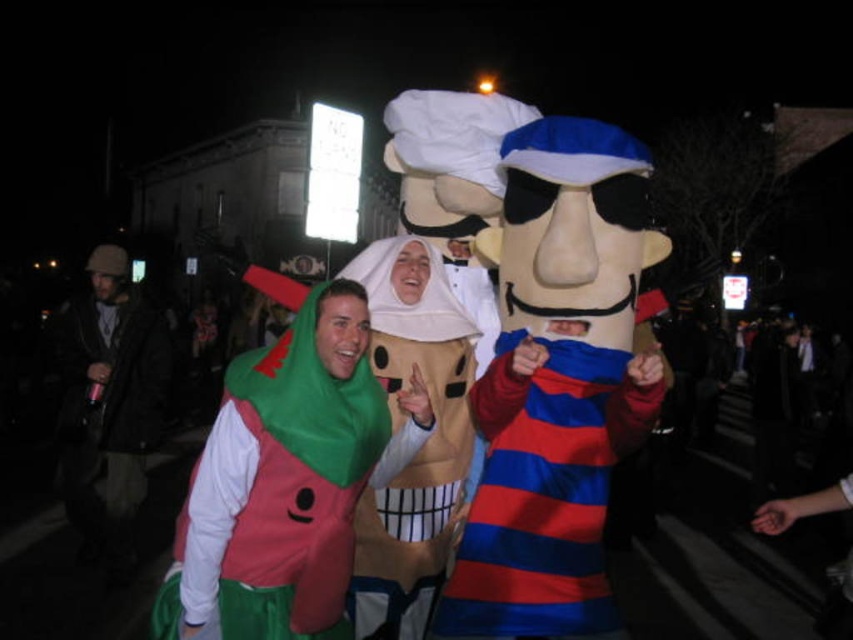
Consider the image. Is striped cotton shirt at center above smooth beige plushie at center?

Actually, striped cotton shirt at center is below smooth beige plushie at center.

Does striped cotton shirt at center appear on the left side of smooth beige plushie at center?

No, striped cotton shirt at center is not to the left of smooth beige plushie at center.

I want to click on striped cotton shirt at center, so click(x=544, y=488).

Is green fabric costume at center closer to camera compared to striped cotton shirt at center?

No, green fabric costume at center is further to the viewer.

Can you confirm if green fabric costume at center is positioned to the left of striped cotton shirt at center?

Indeed, green fabric costume at center is positioned on the left side of striped cotton shirt at center.

Does point (379, 417) come closer to viewer compared to point (570, 506)?

That is True.

Locate an element on the screen. green fabric costume at center is located at coordinates (286, 481).

Which is behind, point (335, 536) or point (111, 534)?

Positioned behind is point (111, 534).

Between green fabric costume at center and dark brown leather jacket at left, which one is positioned lower?

dark brown leather jacket at left

Measure the distance between green fabric costume at center and camera.

5.05 meters

Where is `green fabric costume at center`? green fabric costume at center is located at coordinates (286, 481).